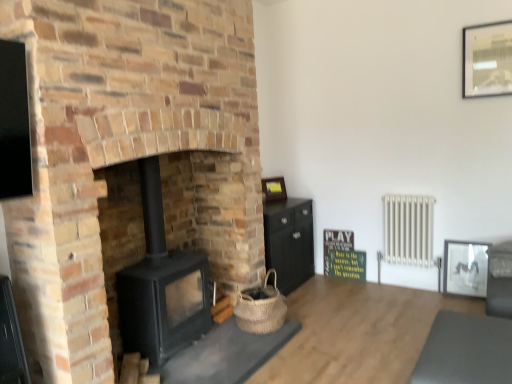
Question: From a real-world perspective, is metallic silver picture frame at upper right, which appears as the third picture frame when viewed from the back, below black matte wood burning stove at center-left?

Choices:
 (A) yes
 (B) no

Answer: (B)

Question: Is metallic silver picture frame at upper right, which appears as the third picture frame when viewed from the back, behind black matte wood burning stove at center-left?

Choices:
 (A) yes
 (B) no

Answer: (A)

Question: Is metallic silver picture frame at upper right, acting as the first picture frame starting from the right, to the left of black matte wood burning stove at center-left from the viewer's perspective?

Choices:
 (A) yes
 (B) no

Answer: (B)

Question: Is metallic silver picture frame at upper right, acting as the first picture frame starting from the right, oriented towards black matte wood burning stove at center-left?

Choices:
 (A) yes
 (B) no

Answer: (B)

Question: Can you confirm if metallic silver picture frame at upper right, the 3th picture frame from the left, is bigger than black matte wood burning stove at center-left?

Choices:
 (A) yes
 (B) no

Answer: (B)

Question: Is matte black picture frame at right, acting as the 2th picture frame starting from the left, outside metallic silver picture frame at upper right, marked as the first picture frame in a front-to-back arrangement?

Choices:
 (A) yes
 (B) no

Answer: (A)

Question: Is matte black picture frame at right, acting as the 2th picture frame starting from the left, positioned with its back to metallic silver picture frame at upper right, which appears as the third picture frame when viewed from the back?

Choices:
 (A) no
 (B) yes

Answer: (A)

Question: Is matte black picture frame at right, the second picture frame positioned from the right, to the right of metallic silver picture frame at upper right, marked as the first picture frame in a front-to-back arrangement, from the viewer's perspective?

Choices:
 (A) no
 (B) yes

Answer: (A)

Question: Is matte black picture frame at right, acting as the 2th picture frame starting from the left, to the left of metallic silver picture frame at upper right, which appears as the third picture frame when viewed from the back, from the viewer's perspective?

Choices:
 (A) no
 (B) yes

Answer: (B)

Question: Is matte black picture frame at right, acting as the 2th picture frame starting from the left, further to the viewer compared to metallic silver picture frame at upper right, the 3th picture frame from the left?

Choices:
 (A) no
 (B) yes

Answer: (B)

Question: From the image's perspective, is matte black picture frame at right, acting as the 2th picture frame starting from the left, on metallic silver picture frame at upper right, acting as the first picture frame starting from the right?

Choices:
 (A) yes
 (B) no

Answer: (B)

Question: Does green matte signboard at center have a greater height compared to black matte wood burning stove at center-left?

Choices:
 (A) yes
 (B) no

Answer: (B)